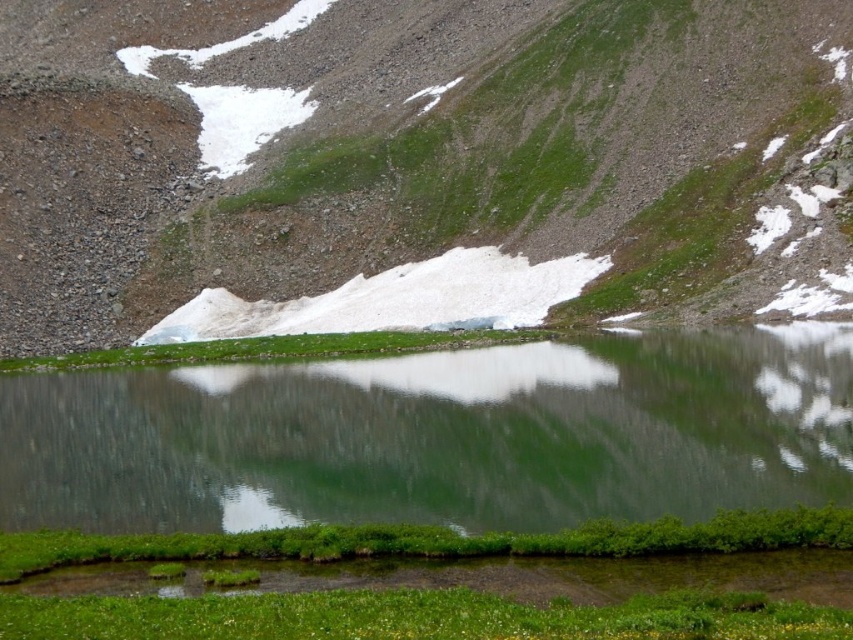
Question: Considering the relative positions of green grassy hillside at center and green reflective water at center in the image provided, where is green grassy hillside at center located with respect to green reflective water at center?

Choices:
 (A) above
 (B) below

Answer: (A)

Question: Is green grassy hillside at center closer to the viewer compared to green reflective water at center?

Choices:
 (A) yes
 (B) no

Answer: (B)

Question: Does green grassy hillside at center come in front of green reflective water at center?

Choices:
 (A) no
 (B) yes

Answer: (A)